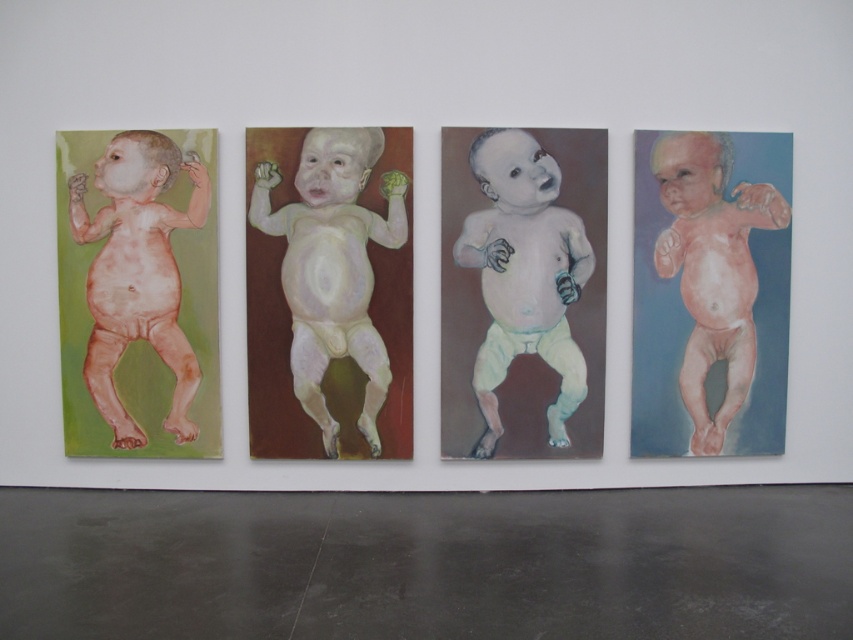
The width and height of the screenshot is (853, 640). Identify the location of smooth pastel baby at center. (329, 292).

The image size is (853, 640). What do you see at coordinates (329, 292) in the screenshot?
I see `smooth pastel baby at center` at bounding box center [329, 292].

Where is `smooth pastel baby at center`? This screenshot has height=640, width=853. smooth pastel baby at center is located at coordinates (329, 292).

Is smooth pastel baby at center shorter than matte pink baby at left?

Incorrect, smooth pastel baby at center's height does not fall short of matte pink baby at left's.

Is smooth pastel baby at center below matte pink baby at left?

Correct, smooth pastel baby at center is located below matte pink baby at left.

I want to click on smooth pastel baby at center, so 329,292.

Is smooth pastel baby at center positioned behind pink pastel baby at center?

No, it is not.

The width and height of the screenshot is (853, 640). I want to click on smooth pastel baby at center, so click(x=329, y=292).

Where is `smooth pastel baby at center`? The height and width of the screenshot is (640, 853). smooth pastel baby at center is located at coordinates (329, 292).